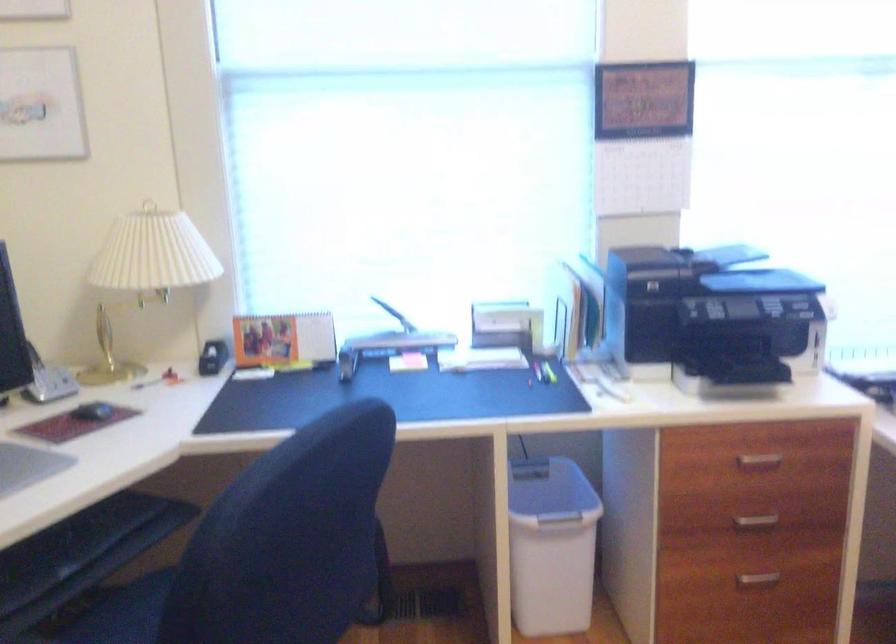
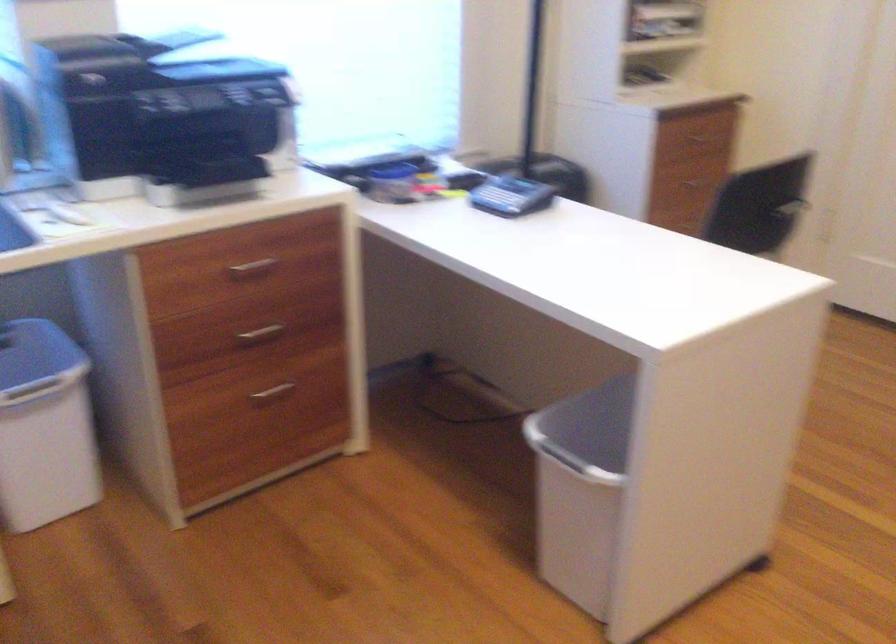
Question: The camera is either moving clockwise (left) or counter-clockwise (right) around the object. The first image is from the beginning of the video and the second image is from the end. Is the camera moving left or right when shooting the video?

Choices:
 (A) Left
 (B) Right

Answer: (A)